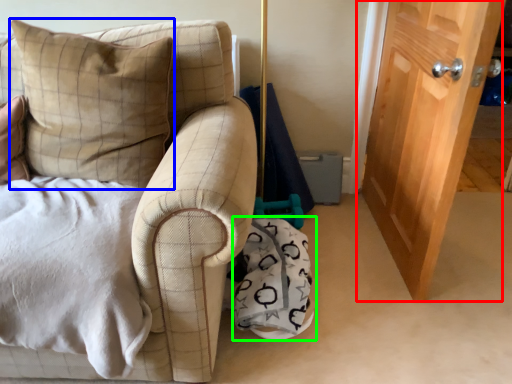
Question: Considering the real-world distances, which object is farthest from door (highlighted by a red box)? pillow (highlighted by a blue box) or material (highlighted by a green box)?

Choices:
 (A) pillow
 (B) material

Answer: (A)